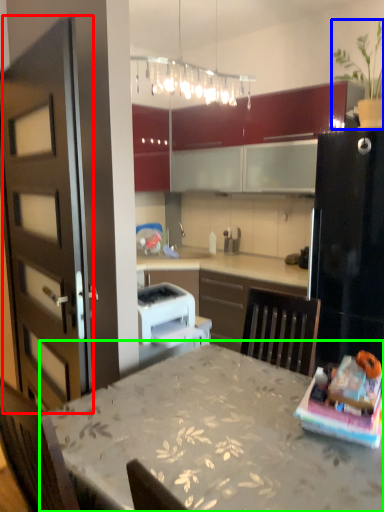
Question: Considering the real-world distances, which object is closest to door (highlighted by a red box)? houseplant (highlighted by a blue box) or table (highlighted by a green box).

Choices:
 (A) houseplant
 (B) table

Answer: (B)